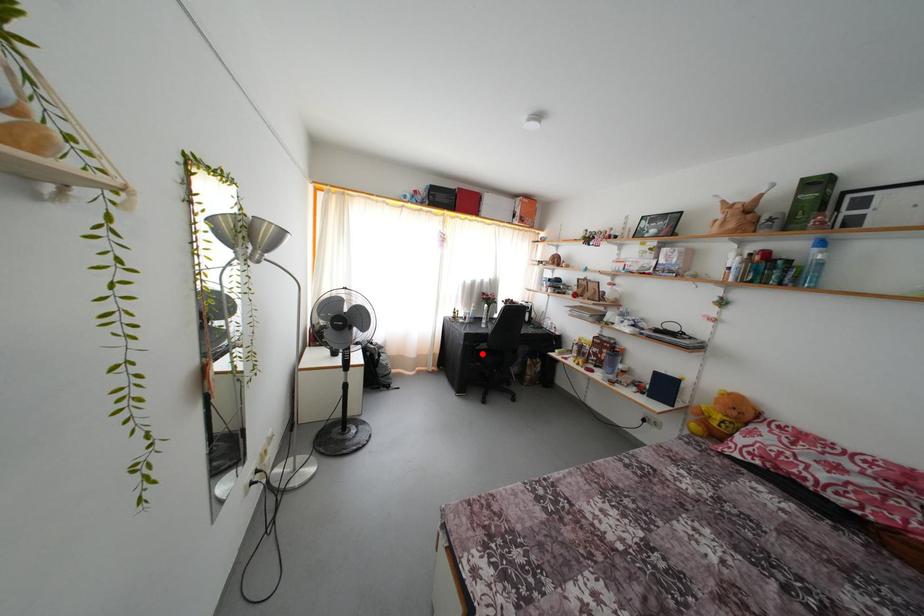
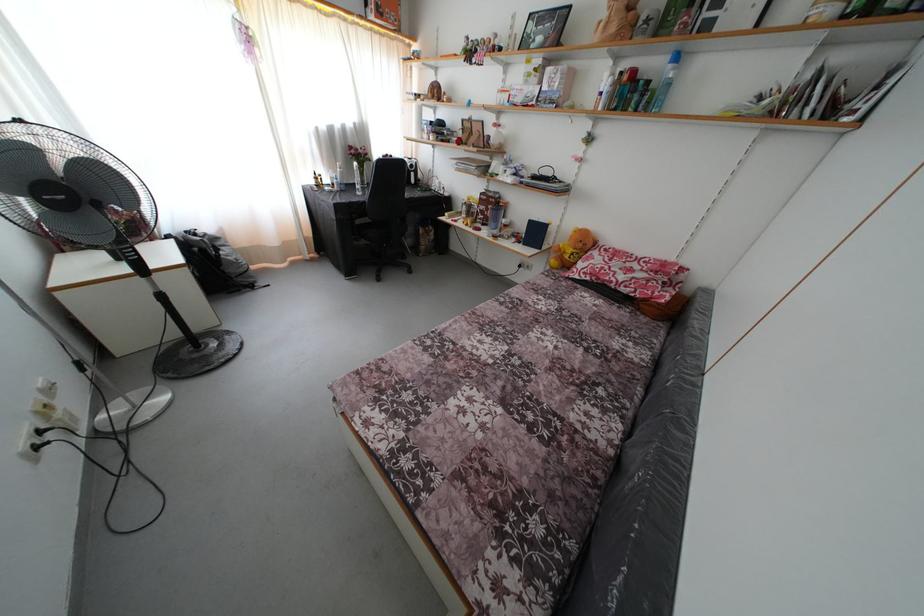
Locate, in the second image, the point that corresponds to the highlighted location in the first image.

(362, 228)